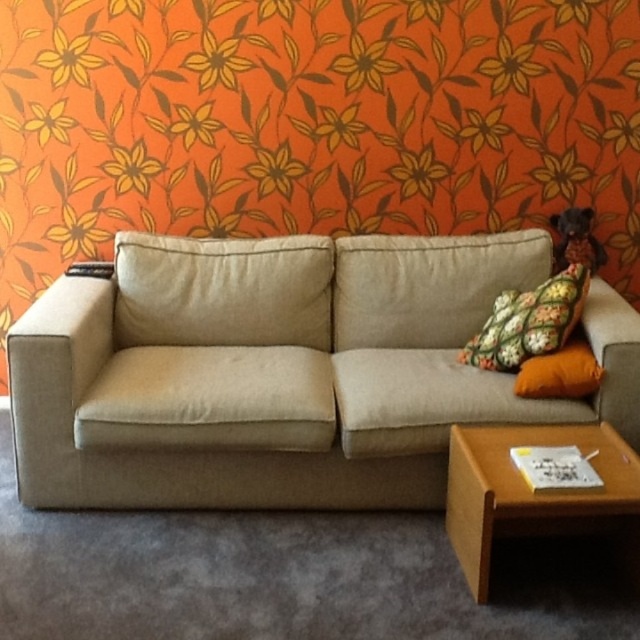
From the picture: You are trying to place a new rectangular coffee table between the beige fabric couch at center and the orange fabric pillow at right. Based on their sizes, will the coffee table fit comfortably between them?

The beige fabric couch at center might be wider than orange fabric pillow at right, so the coffee table may not fit comfortably between them if the couch is indeed wider.

You are standing in the living room and want to place a small book on the beige fabric couch at center. The book is 10 cm in width. Can you place it at the point marked by coordinates point (x=282, y=371)?

The point (x=282, y=371) is on the beige fabric couch at center, so yes, you can place the small book there as the couch has enough space to accommodate it.